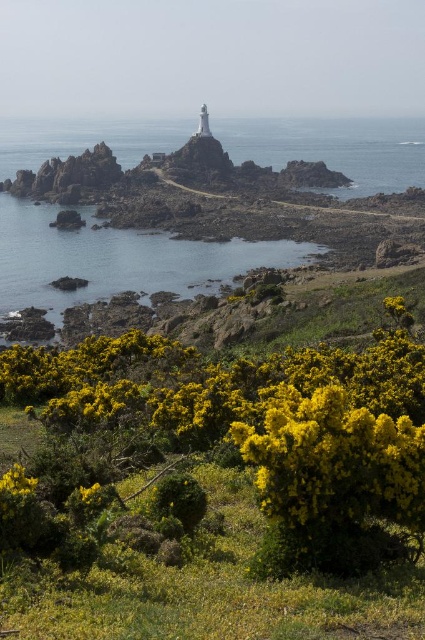
Who is positioned more to the right, transparent blue water at center or yellow matte flower at lower center?

Positioned to the right is yellow matte flower at lower center.

Which is behind, point (22, 164) or point (405, 300)?

Point (22, 164)

I want to click on transparent blue water at center, so pos(334,148).

Which is behind, point (342, 124) or point (96, 484)?

Positioned behind is point (342, 124).

Between point (14, 144) and point (96, 484), which one is positioned behind?

The point (14, 144) is behind.

I want to click on transparent blue water at center, so click(x=334, y=148).

Who is more distant from viewer, (418, 424) or (384, 307)?

The point (384, 307) is behind.

From the picture: Who is shorter, yellow fluffy bush at lower center or yellow matte flower at lower center?

yellow matte flower at lower center

Where is `yellow fluffy bush at lower center`? This screenshot has height=640, width=425. yellow fluffy bush at lower center is located at coordinates (231, 400).